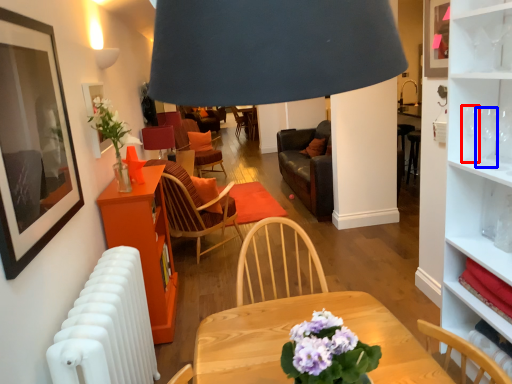
Question: Which object appears farthest to the camera in this image, wine glass (highlighted by a red box) or wine glass (highlighted by a blue box)?

Choices:
 (A) wine glass
 (B) wine glass

Answer: (A)